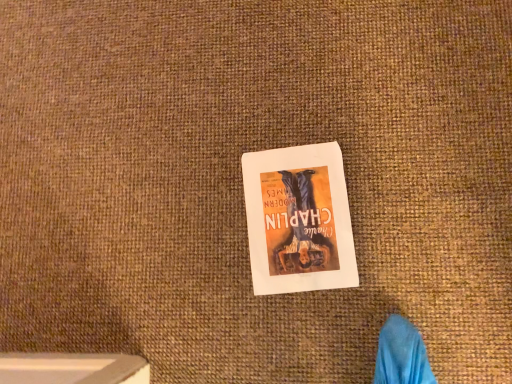
At what (x,y) coordinates should I click in order to perform the action: click on unoccupied space behind white paper at center. Please return your answer as a coordinate pair (x, y). Image resolution: width=512 pixels, height=384 pixels. Looking at the image, I should click on (229, 129).